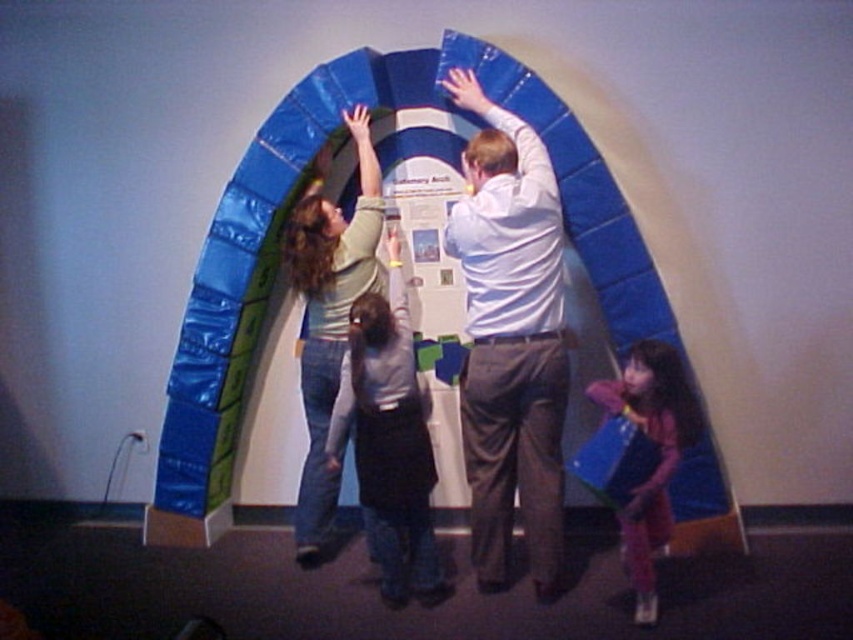
Is white matte shirt at center further to the viewer compared to matte green shirt at center?

No, it is in front of matte green shirt at center.

Who is shorter, white matte shirt at center or matte green shirt at center?

matte green shirt at center is shorter.

Between point (546, 182) and point (370, 204), which one is positioned in front?

Positioned in front is point (546, 182).

In order to click on white matte shirt at center in this screenshot , I will do `click(509, 340)`.

Is white matte shirt at center bigger than matte pink dress at lower right?

Indeed, white matte shirt at center has a larger size compared to matte pink dress at lower right.

Between white matte shirt at center and matte pink dress at lower right, which one has more height?

white matte shirt at center is taller.

Who is more forward, [479,252] or [625,508]?

Point [625,508] is in front.

Locate an element on the screen. Image resolution: width=853 pixels, height=640 pixels. white matte shirt at center is located at coordinates (509, 340).

Who is higher up, matte green shirt at center or matte pink dress at lower right?

matte green shirt at center

Can you confirm if matte green shirt at center is positioned to the right of matte pink dress at lower right?

In fact, matte green shirt at center is to the left of matte pink dress at lower right.

Find the location of `matte green shirt at center`. matte green shirt at center is located at coordinates (329, 314).

Identify the location of matte green shirt at center. This screenshot has height=640, width=853. (329, 314).